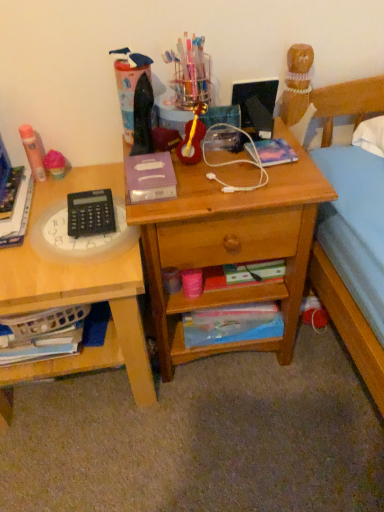
Where is `vacant space to the right of white matte earphones at center`? The image size is (384, 512). vacant space to the right of white matte earphones at center is located at coordinates (288, 173).